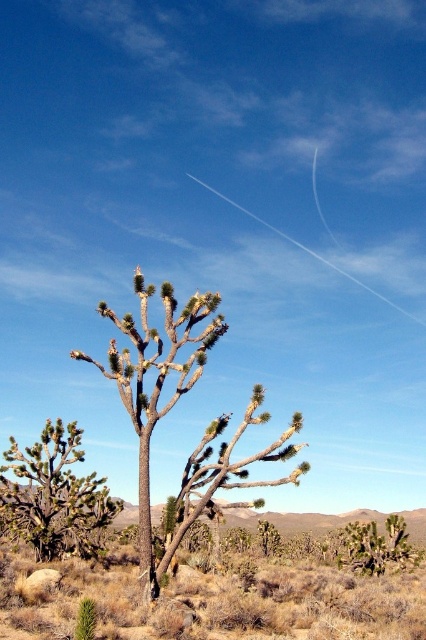
Does brown textured tree at center have a larger size compared to green spiky cactus at center?

Indeed, brown textured tree at center has a larger size compared to green spiky cactus at center.

Is brown textured tree at center closer to camera compared to green spiky cactus at center?

Yes, brown textured tree at center is closer to the viewer.

Which is in front, point (253, 417) or point (103, 504)?

Positioned in front is point (253, 417).

Locate an element on the screen. This screenshot has width=426, height=640. brown textured tree at center is located at coordinates (172, 406).